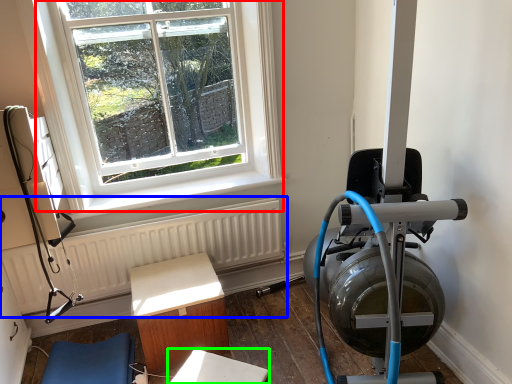
Question: Which object is the farthest from window (highlighted by a red box)? Choose among these: radiator (highlighted by a blue box) or table (highlighted by a green box).

Choices:
 (A) radiator
 (B) table

Answer: (B)